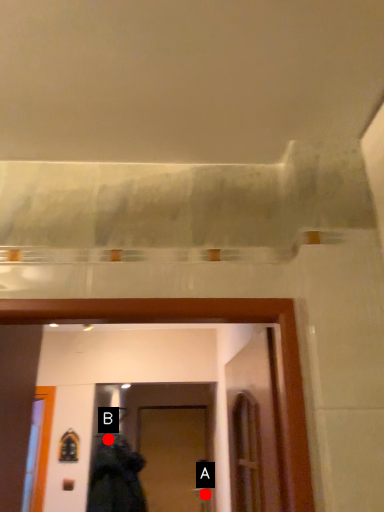
Question: Two points are circled on the image, labeled by A and B beside each circle. Which point is further to the camera?

Choices:
 (A) A is further
 (B) B is further

Answer: (A)